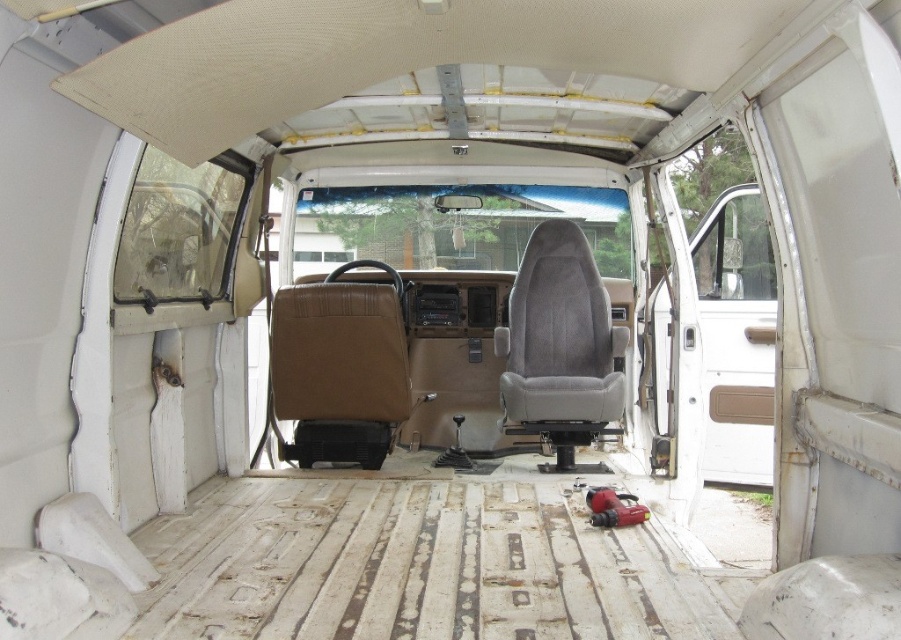
You are standing inside the van and want to sit down. Where exactly is the brown leather seat at center located?

The brown leather seat at center is located at point (340, 369).

You are sitting in the van and want to move from the brown leather seat at center to the gray fabric seat at center. Which direction should you move to reach it?

The brown leather seat at center is to the left of the gray fabric seat at center, so you should move to the right to reach it.